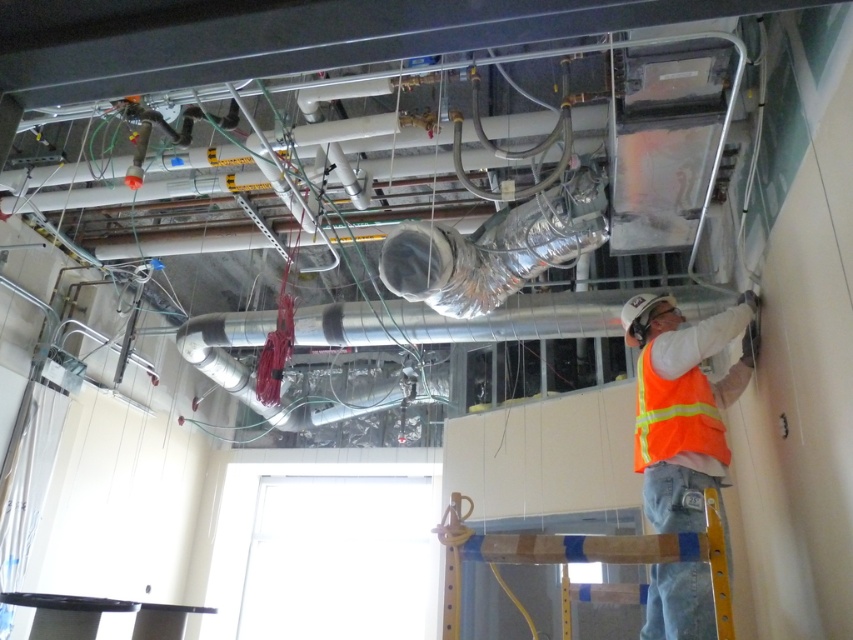
Question: Which point is closer to the camera?

Choices:
 (A) silver metallic duct at upper center
 (B) orange reflective vest at center
 (C) high visibility orange safety vest at lower right
 (D) wooden beam at center

Answer: (D)

Question: Which of the following is the closest to the observer?

Choices:
 (A) wooden beam at center
 (B) silver metallic duct at upper center
 (C) wooden at lower right
 (D) orange reflective vest at center

Answer: (C)

Question: Which object is farther from the camera taking this photo?

Choices:
 (A) wooden at lower right
 (B) silver metallic duct at upper center

Answer: (B)

Question: Is orange reflective vest at center bigger than silver metallic duct at upper center?

Choices:
 (A) yes
 (B) no

Answer: (A)

Question: Is silver metallic duct at upper center thinner than high visibility orange safety vest at lower right?

Choices:
 (A) yes
 (B) no

Answer: (B)

Question: Considering the relative positions of orange reflective vest at center and silver metallic duct at upper center in the image provided, where is orange reflective vest at center located with respect to silver metallic duct at upper center?

Choices:
 (A) below
 (B) above

Answer: (A)